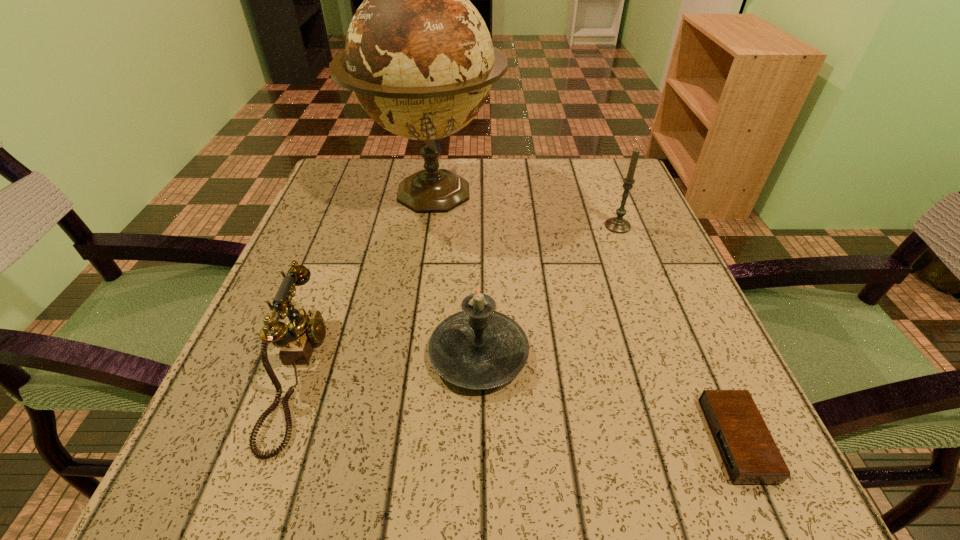
I want to click on globe, so (419, 58).

Where is `the fourth shortest object`? Image resolution: width=960 pixels, height=540 pixels. the fourth shortest object is located at coordinates (617, 224).

Locate an element on the screen. Image resolution: width=960 pixels, height=540 pixels. the farther candle is located at coordinates (x=617, y=224).

Locate an element on the screen. The width and height of the screenshot is (960, 540). the nearer candle is located at coordinates (478, 348).

Identify the location of the shorter candle. (478, 348).

This screenshot has height=540, width=960. I want to click on telephone, so click(x=297, y=339).

Identify the location of alarm clock. Image resolution: width=960 pixels, height=540 pixels. (750, 455).

Locate an element on the screen. vacant space situated 0.140m on the front of the tallest object showing Asia is located at coordinates (418, 285).

Where is `free point located on the front of the farther candle`? The width and height of the screenshot is (960, 540). free point located on the front of the farther candle is located at coordinates (661, 341).

The width and height of the screenshot is (960, 540). What are the coordinates of `free space located 0.290m on the right of the left candle` in the screenshot? It's located at (715, 354).